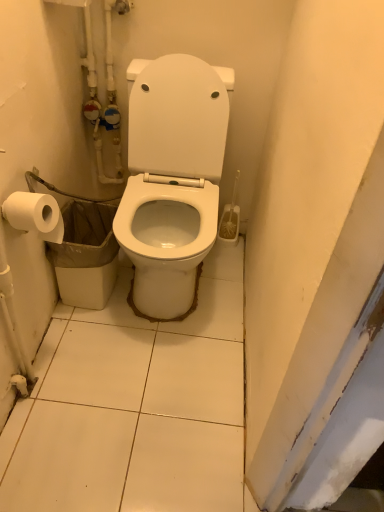
Question: In terms of height, does white glossy toilet at center look taller or shorter compared to white plastic trash can at lower left?

Choices:
 (A) tall
 (B) short

Answer: (A)

Question: From the image's perspective, is white glossy toilet at center located above or below white plastic trash can at lower left?

Choices:
 (A) below
 (B) above

Answer: (B)

Question: Estimate the real-world distances between objects in this image. Which object is farther from the white plastic trash can at lower left?

Choices:
 (A) white matte toilet paper at left
 (B) white glossy toilet at center

Answer: (A)

Question: Estimate the real-world distances between objects in this image. Which object is farther from the white matte toilet paper at left?

Choices:
 (A) white plastic trash can at lower left
 (B) white glossy toilet at center

Answer: (B)